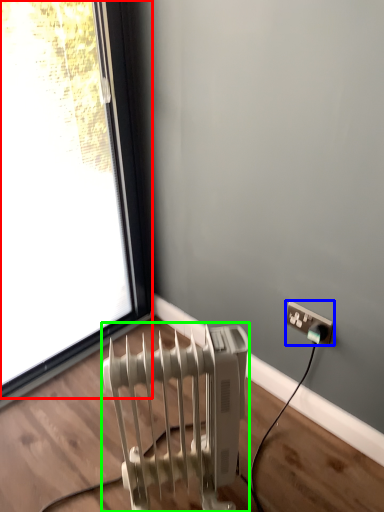
Question: Which object is the closest to the window (highlighted by a red box)? Choose among these: power plugs and sockets (highlighted by a blue box) or radiator (highlighted by a green box).

Choices:
 (A) power plugs and sockets
 (B) radiator

Answer: (B)